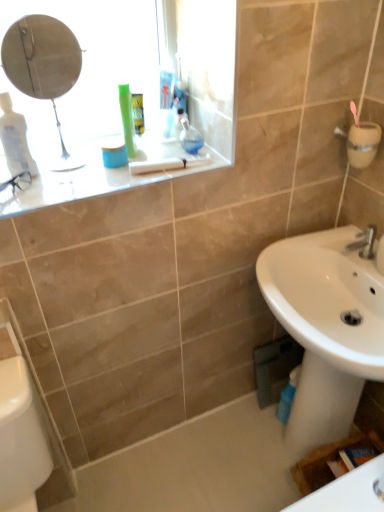
Question: In the image, is white glossy counter top at upper left positioned in front of or behind white glossy sink at lower right?

Choices:
 (A) behind
 (B) front

Answer: (A)

Question: Considering the positions of white glossy counter top at upper left and white glossy sink at lower right in the image, is white glossy counter top at upper left bigger or smaller than white glossy sink at lower right?

Choices:
 (A) big
 (B) small

Answer: (B)

Question: Estimate the real-world distances between objects in this image. Which object is farther from the white glossy counter top at upper left?

Choices:
 (A) white glossy sink at lower right
 (B) white glossy porcelain at lower left
 (C) white glossy bath at lower center
 (D) silver metallic faucet at lower right

Answer: (C)

Question: Which is farther from the white glossy bath at lower center?

Choices:
 (A) white glossy counter top at upper left
 (B) white glossy sink at lower right
 (C) white glossy porcelain at lower left
 (D) silver metallic faucet at lower right

Answer: (A)